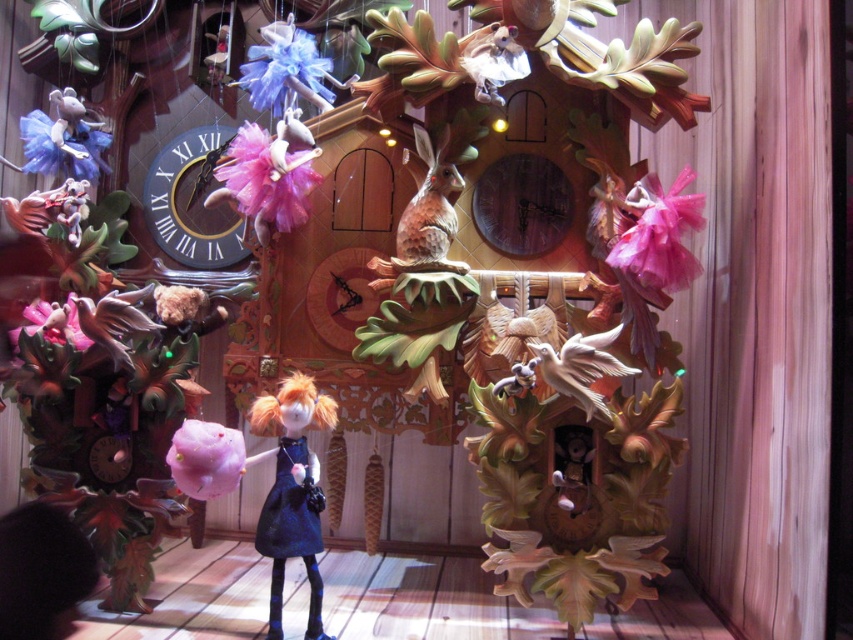
You are an interior designer planning to place a small potted plant between the velvet blue dress at center and the matte black clock at left. Given their height difference, which object should the plant be placed closer to for visual balance?

The velvet blue dress at center is much taller than the matte black clock at left, so the plant should be placed closer to the matte black clock at left to balance the height difference.

You are an interior designer planning to place a decorative item between the velvet blue dress at center and the wooden carved bird at center on the cuckoo clock. Which object should the item be placed closer to if it needs to avoid being overshadowed by the taller object?

The velvet blue dress at center is taller than the wooden carved bird at center. To avoid overshadowing, the decorative item should be placed closer to the wooden carved bird at center.

You are a photographer standing 1.6 meters away from a cuckoo clock. You want to take a closeup photo of the velvet blue dress at center. Is the distance sufficient to capture the dress clearly?

The velvet blue dress at center is 1.58 meters from the camera. Since the photographer is standing 1.6 meters away, the distance is sufficient to capture the dress clearly as it is just slightly farther than the photographer.